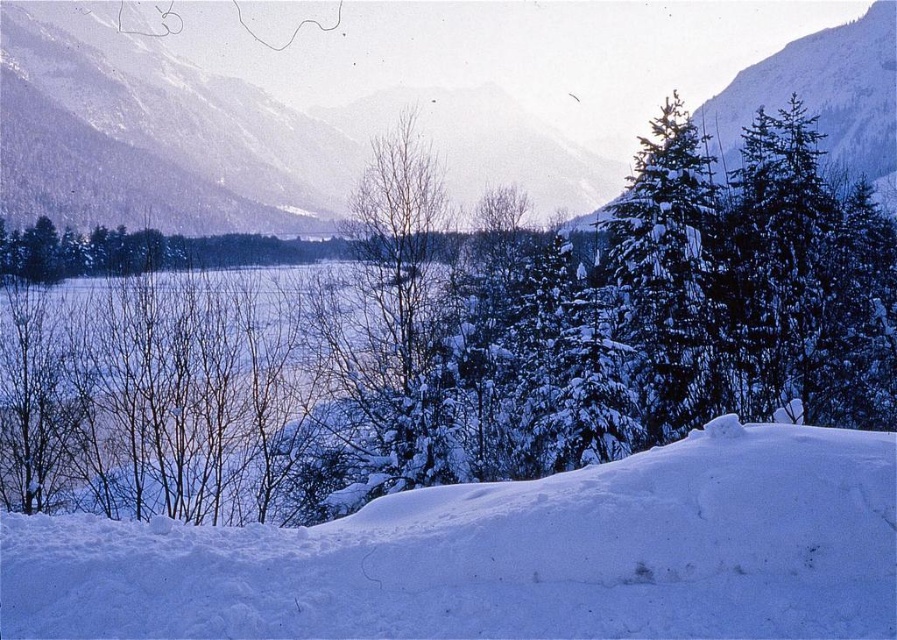
Consider the image. Does white snow at lower center have a larger size compared to snowy mountain at upper center?

No.

Where is `white snow at lower center`? Image resolution: width=897 pixels, height=640 pixels. white snow at lower center is located at coordinates (507, 554).

Does point (512, 532) come closer to viewer compared to point (767, 81)?

That is True.

Locate an element on the screen. The width and height of the screenshot is (897, 640). white snow at lower center is located at coordinates (507, 554).

Is white snow at lower center closer to camera compared to snow-covered evergreen at center-right?

Yes, white snow at lower center is closer to the viewer.

Can you confirm if white snow at lower center is smaller than snow-covered evergreen at center-right?

Correct, white snow at lower center occupies less space than snow-covered evergreen at center-right.

The image size is (897, 640). I want to click on white snow at lower center, so click(507, 554).

Can you confirm if snowy mountain at upper center is bigger than snow-covered evergreen at center-right?

Yes, snowy mountain at upper center is bigger than snow-covered evergreen at center-right.

Which is in front, point (841, 40) or point (638, 316)?

Point (638, 316)

You are a GUI agent. You are given a task and a screenshot of the screen. Output one action in this format:
    pyautogui.click(x=<x>, y=<y>)
    Task: Click on the snowy mountain at upper center
    
    Given the screenshot: What is the action you would take?
    pyautogui.click(x=234, y=138)